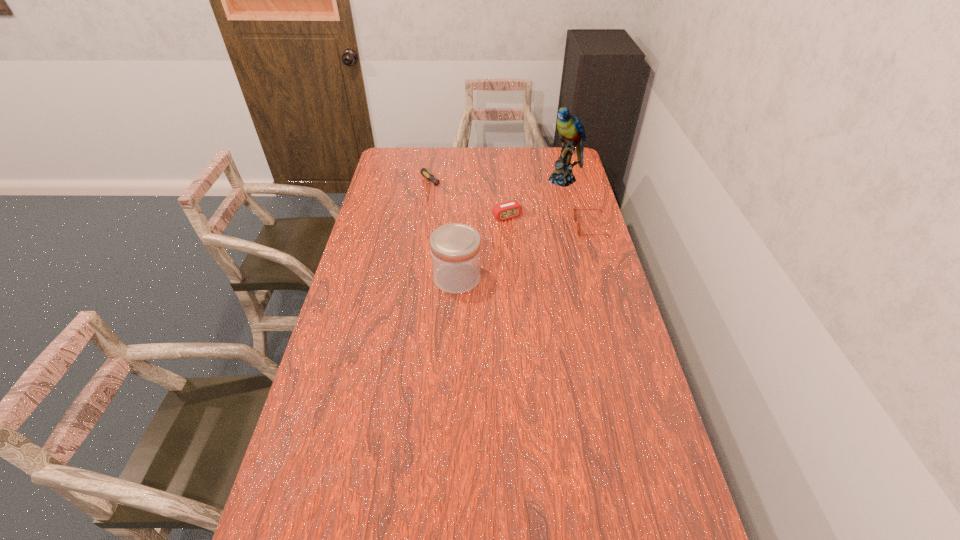
You are a GUI agent. You are given a task and a screenshot of the screen. Output one action in this format:
    pyautogui.click(x=<x>, y=<y>)
    Task: Click on the screwdriver present at the far edge
    
    Given the screenshot: What is the action you would take?
    pyautogui.click(x=429, y=176)

Image resolution: width=960 pixels, height=540 pixels. In order to click on parrot located at the far edge in this screenshot , I will do `click(571, 131)`.

At what (x,y) coordinates should I click in order to perform the action: click on sunglasses located in the right edge section of the desktop. Please return your answer as a coordinate pair (x, y). Image resolution: width=960 pixels, height=540 pixels. Looking at the image, I should click on (575, 210).

The height and width of the screenshot is (540, 960). Identify the location of parrot at the right edge. point(571,131).

Identify the location of object at the far right corner. (571, 131).

This screenshot has width=960, height=540. In the image, there is a desktop. What are the coordinates of `free region at the far edge` in the screenshot? It's located at (533, 171).

What are the coordinates of `vacant position at the near edge of the desktop` in the screenshot? It's located at (569, 502).

Find the location of a particular element. free region at the left edge is located at coordinates (380, 303).

The image size is (960, 540). Find the location of `vacant region at the right edge of the desktop`. vacant region at the right edge of the desktop is located at coordinates (584, 246).

The height and width of the screenshot is (540, 960). In order to click on free space between the tallest object and the shortest object in this screenshot , I will do `click(500, 183)`.